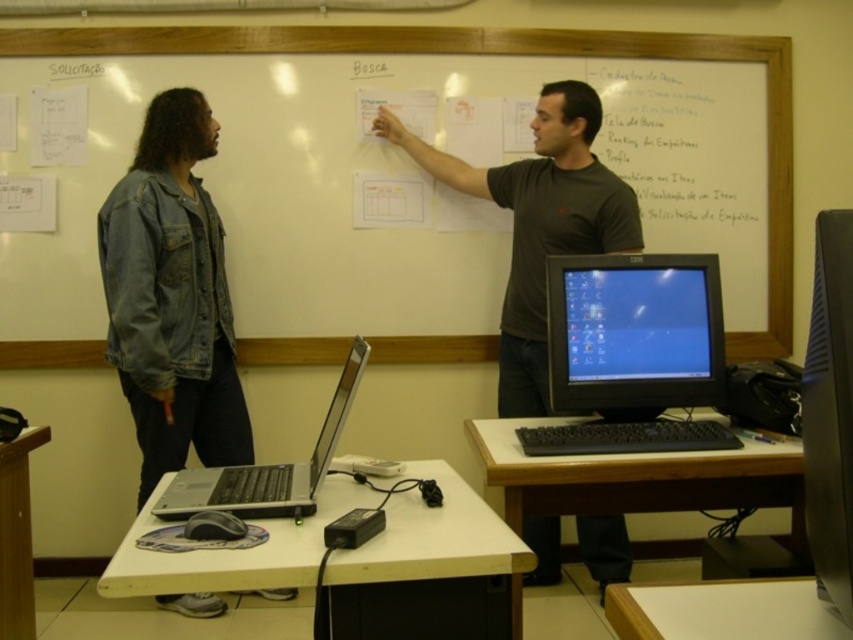
Is the position of dark gray t-shirt at upper center less distant than that of black plastic monitor at right?

No, dark gray t-shirt at upper center is further to the viewer.

Locate an element on the screen. dark gray t-shirt at upper center is located at coordinates (538, 221).

Is dark gray t-shirt at upper center below wooden podium at lower left?

No, dark gray t-shirt at upper center is not below wooden podium at lower left.

Is dark gray t-shirt at upper center shorter than wooden podium at lower left?

No, dark gray t-shirt at upper center is not shorter than wooden podium at lower left.

This screenshot has width=853, height=640. I want to click on dark gray t-shirt at upper center, so click(x=538, y=221).

You are a GUI agent. You are given a task and a screenshot of the screen. Output one action in this format:
    pyautogui.click(x=<x>, y=<y>)
    Task: Click on the dark gray t-shirt at upper center
    
    Given the screenshot: What is the action you would take?
    pyautogui.click(x=538, y=221)

Does black plastic monitor at right appear on the right side of wooden podium at lower left?

Yes, black plastic monitor at right is to the right of wooden podium at lower left.

What do you see at coordinates (828, 412) in the screenshot? The image size is (853, 640). I see `black plastic monitor at right` at bounding box center [828, 412].

Where is `black plastic monitor at right`? Image resolution: width=853 pixels, height=640 pixels. black plastic monitor at right is located at coordinates (828, 412).